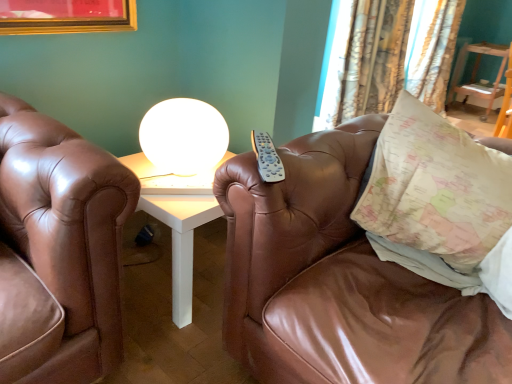
Question: Can you confirm if white glossy sphere at upper center is smaller than patterned fabric curtain at upper right, the 2th curtain positioned from the back?

Choices:
 (A) no
 (B) yes

Answer: (B)

Question: From the image's perspective, is white glossy sphere at upper center under patterned fabric curtain at upper right, placed as the 1th curtain when sorted from front to back?

Choices:
 (A) yes
 (B) no

Answer: (A)

Question: Is the position of white glossy sphere at upper center more distant than that of patterned fabric curtain at upper right, which is the 1th curtain from left to right?

Choices:
 (A) no
 (B) yes

Answer: (A)

Question: Is white glossy sphere at upper center oriented towards patterned fabric curtain at upper right, placed as the 1th curtain when sorted from front to back?

Choices:
 (A) no
 (B) yes

Answer: (A)

Question: Is patterned fabric curtain at upper right, which is the 1th curtain from left to right, completely or partially inside white glossy sphere at upper center?

Choices:
 (A) no
 (B) yes

Answer: (A)

Question: Is white glossy sphere at upper center at the left side of patterned fabric curtain at upper right, placed as the 1th curtain when sorted from front to back?

Choices:
 (A) no
 (B) yes

Answer: (B)

Question: Would you say patterned fabric curtain at upper right, the 2th curtain in the left-to-right sequence, contains brown leather couch at center?

Choices:
 (A) no
 (B) yes

Answer: (A)

Question: Is patterned fabric curtain at upper right, which ranks as the first curtain in back-to-front order, far away from brown leather couch at center?

Choices:
 (A) no
 (B) yes

Answer: (B)

Question: Considering the relative sizes of patterned fabric curtain at upper right, the 2th curtain in the left-to-right sequence, and brown leather couch at center in the image provided, is patterned fabric curtain at upper right, the 2th curtain in the left-to-right sequence, taller than brown leather couch at center?

Choices:
 (A) yes
 (B) no

Answer: (A)

Question: Is patterned fabric curtain at upper right, which ranks as the first curtain in back-to-front order, outside brown leather couch at center?

Choices:
 (A) yes
 (B) no

Answer: (A)

Question: Is patterned fabric curtain at upper right, the 1th curtain in the right-to-left sequence, directly adjacent to brown leather couch at center?

Choices:
 (A) no
 (B) yes

Answer: (A)

Question: Does patterned fabric curtain at upper right, which ranks as the first curtain in back-to-front order, have a greater width compared to brown leather couch at center?

Choices:
 (A) no
 (B) yes

Answer: (A)

Question: Is map-patterned fabric pillow at right looking in the opposite direction of patterned fabric curtain at upper right, the 1th curtain in the right-to-left sequence?

Choices:
 (A) yes
 (B) no

Answer: (A)